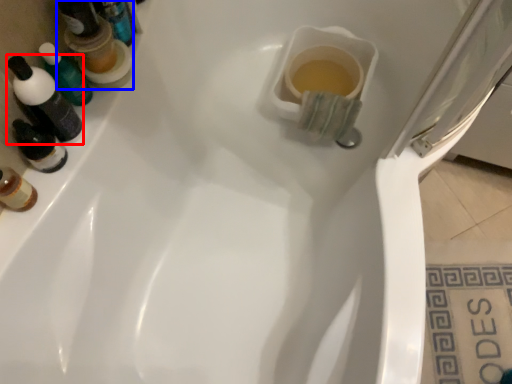
Question: Which object appears closest to the camera in this image, mouthwash (highlighted by a red box) or mouthwash (highlighted by a blue box)?

Choices:
 (A) mouthwash
 (B) mouthwash

Answer: (A)